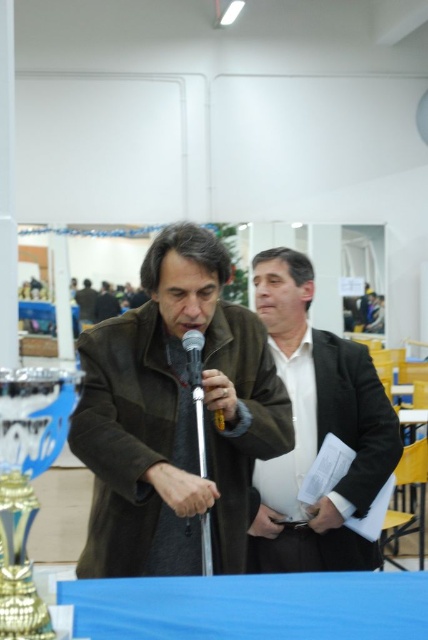
Does brown leather jacket at center have a greater width compared to matte black suit at center?

Yes.

Is brown leather jacket at center below matte black suit at center?

No, brown leather jacket at center is not below matte black suit at center.

Image resolution: width=428 pixels, height=640 pixels. What are the coordinates of `brown leather jacket at center` in the screenshot? It's located at (175, 417).

Can you confirm if gold metallic trophy at lower left is positioned to the left of silver metallic microphone at center?

Correct, you'll find gold metallic trophy at lower left to the left of silver metallic microphone at center.

Who is more distant from viewer, (47, 451) or (196, 346)?

The point (196, 346) is behind.

At what (x,y) coordinates should I click in order to perform the action: click on gold metallic trophy at lower left. Please return your answer as a coordinate pair (x, y). The image size is (428, 640). Looking at the image, I should click on (26, 484).

How distant is matte black suit at center from silver metallic microphone at center?

matte black suit at center and silver metallic microphone at center are 28.66 inches apart from each other.

Between matte black suit at center and silver metallic microphone at center, which one is positioned lower?

matte black suit at center is below.

Measure the distance between point (276, 256) and camera.

They are 7.59 feet apart.

Image resolution: width=428 pixels, height=640 pixels. I want to click on matte black suit at center, so click(x=317, y=429).